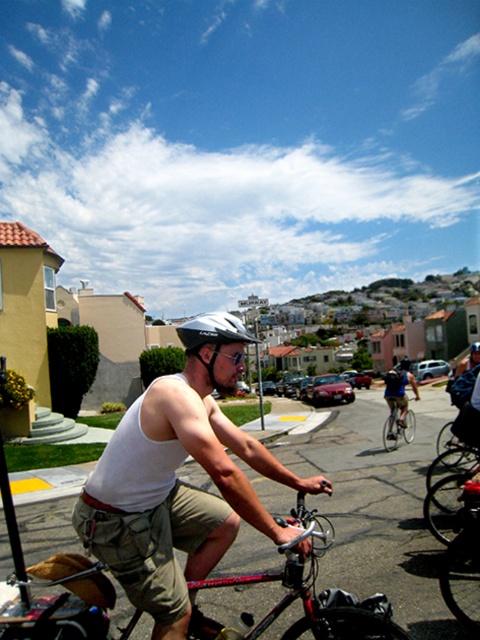
Question: Can you confirm if shiny metallic bicycle at center is positioned to the right of matte black backpack at center?

Choices:
 (A) yes
 (B) no

Answer: (B)

Question: Is white matte tank top at center to the left of matte black backpack at center from the viewer's perspective?

Choices:
 (A) no
 (B) yes

Answer: (B)

Question: Among these objects, which one is nearest to the camera?

Choices:
 (A) camouflage fabric vest at center
 (B) metallic silver bicycle at center
 (C) shiny metallic bicycle at center

Answer: (C)

Question: Among these points, which one is farthest from the camera?

Choices:
 (A) (392, 385)
 (B) (408, 413)
 (C) (182, 422)

Answer: (B)

Question: Which object is farther from the camera taking this photo?

Choices:
 (A) white matte tank top at center
 (B) metallic silver bicycle at center

Answer: (B)

Question: Considering the relative positions of shiny metallic bicycle at center and matte black helmet at center in the image provided, where is shiny metallic bicycle at center located with respect to matte black helmet at center?

Choices:
 (A) right
 (B) left

Answer: (A)